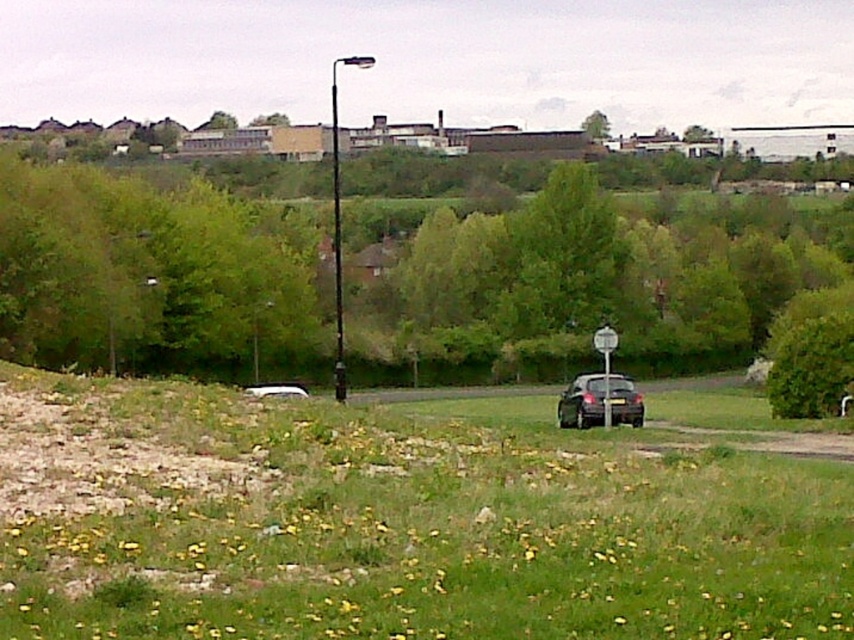
Which is more to the left, green grassy field at center or metallic silver street sign at center?

Positioned to the left is green grassy field at center.

Who is more forward, (x=398, y=502) or (x=603, y=358)?

Point (x=398, y=502) is in front.

This screenshot has height=640, width=854. In order to click on green grassy field at center in this screenshot , I will do `click(395, 524)`.

Find the location of `green grassy field at center`. green grassy field at center is located at coordinates (395, 524).

Which is in front, point (542, 189) or point (611, 419)?

Point (611, 419)

Is point (582, 314) closer to camera compared to point (594, 406)?

No, (582, 314) is behind (594, 406).

Find the location of `green leafy tree at center`. green leafy tree at center is located at coordinates (154, 276).

Does green grassy field at center appear on the right side of satin black car at center?

No, green grassy field at center is not to the right of satin black car at center.

Between green grassy field at center and satin black car at center, which one appears on the left side from the viewer's perspective?

green grassy field at center

Between point (0, 420) and point (619, 380), which one is positioned behind?

The point (619, 380) is more distant.

Image resolution: width=854 pixels, height=640 pixels. Identify the location of green grassy field at center. (395, 524).